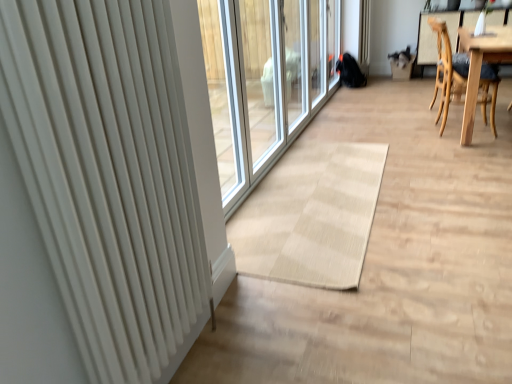
Question: From their relative heights in the image, would you say white matte radiator at left is taller or shorter than light brown wooden chair at right?

Choices:
 (A) tall
 (B) short

Answer: (A)

Question: Is white matte radiator at left inside the boundaries of light brown wooden chair at right, or outside?

Choices:
 (A) outside
 (B) inside

Answer: (A)

Question: From a real-world perspective, is white matte radiator at left positioned above or below light brown wooden chair at right?

Choices:
 (A) below
 (B) above

Answer: (B)

Question: Do you think light brown wooden chair at right is within white matte radiator at left, or outside of it?

Choices:
 (A) inside
 (B) outside

Answer: (B)

Question: In the image, is light brown wooden chair at right positioned in front of or behind white matte radiator at left?

Choices:
 (A) front
 (B) behind

Answer: (B)

Question: Looking at their shapes, would you say light brown wooden chair at right is wider or thinner than white matte radiator at left?

Choices:
 (A) thin
 (B) wide

Answer: (B)

Question: Considering the positions of point (443, 97) and point (162, 29), is point (443, 97) closer or farther from the camera than point (162, 29)?

Choices:
 (A) closer
 (B) farther

Answer: (B)